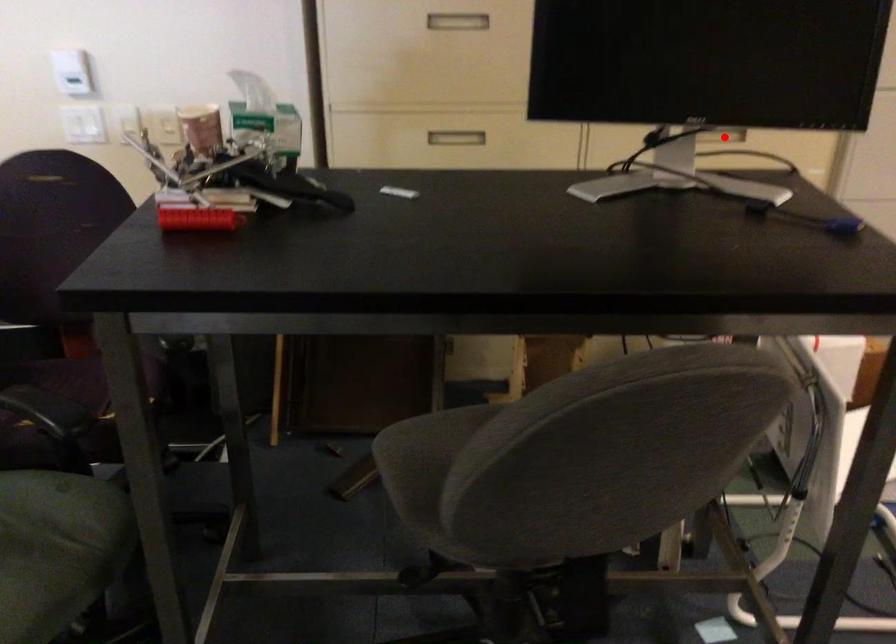
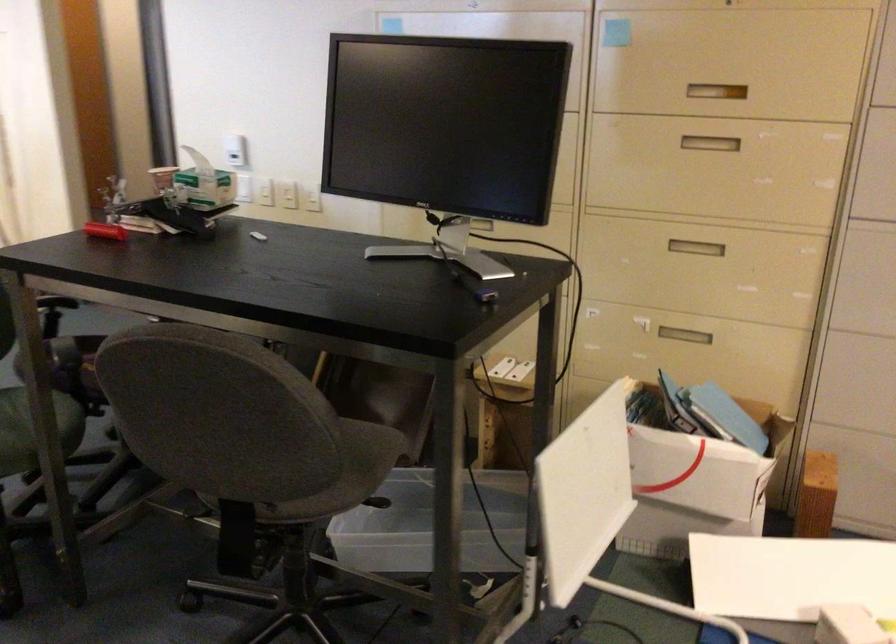
Where in the second image is the point corresponding to the highlighted location from the first image?

(695, 247)